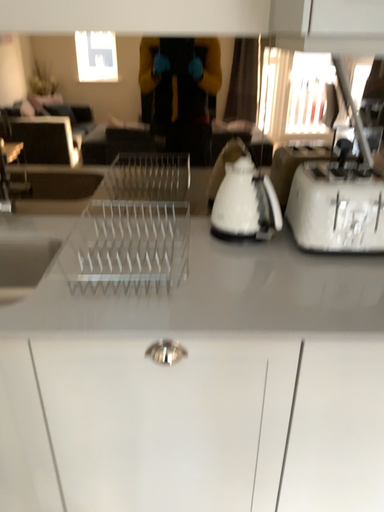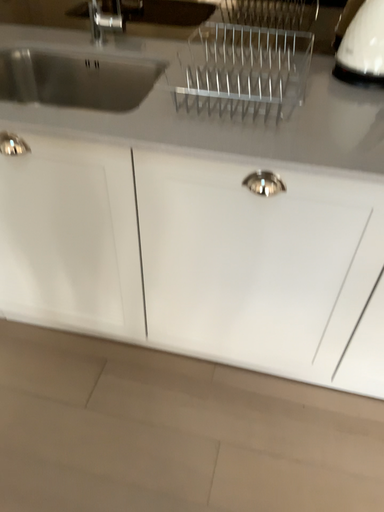
Question: Which way did the camera rotate in the video?

Choices:
 (A) rotated upward
 (B) rotated downward

Answer: (B)